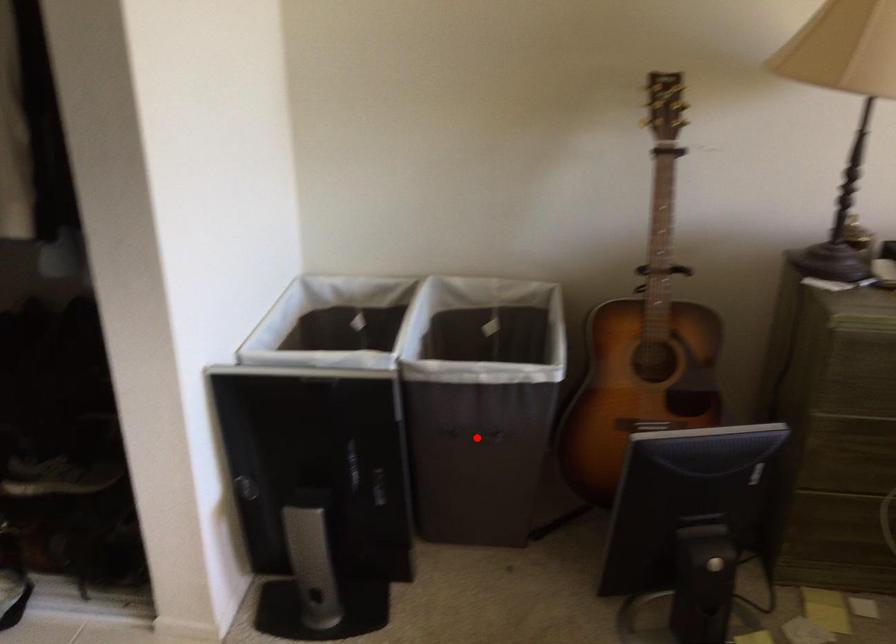
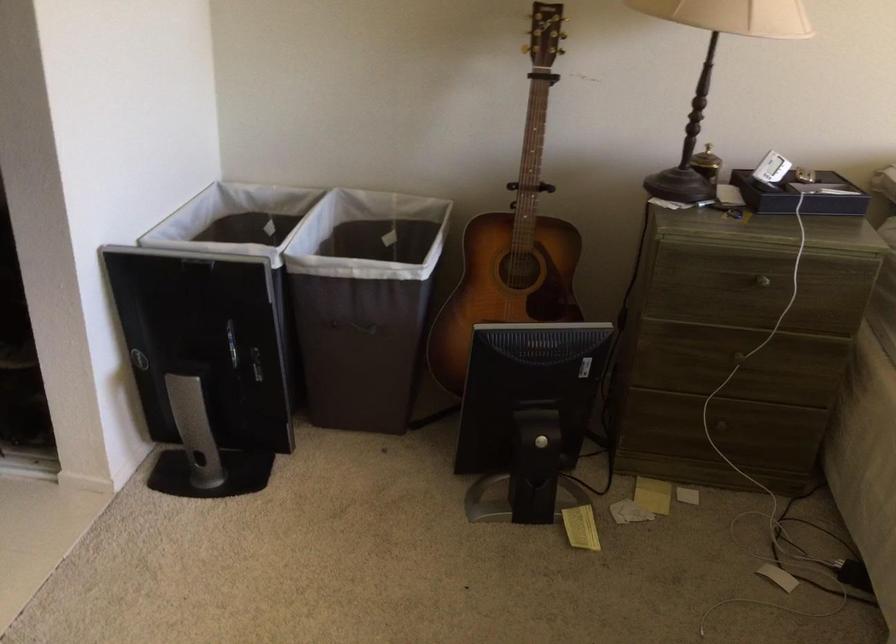
In the second image, find the point that corresponds to the highlighted location in the first image.

(357, 327)